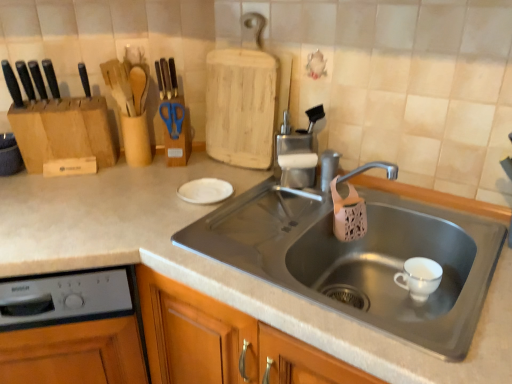
Find the location of `free space to the back side of black matte knife at left, which is the third knife from left to right`. free space to the back side of black matte knife at left, which is the third knife from left to right is located at coordinates (67, 99).